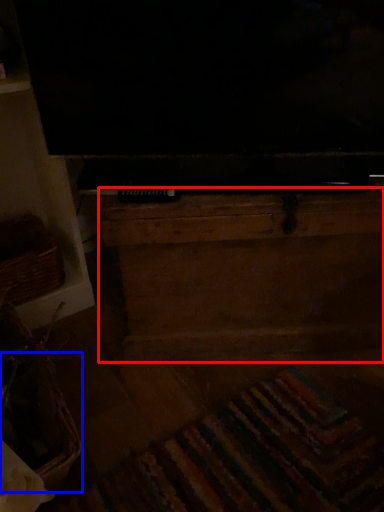
Question: Which point is closer to the camera, dresser (highlighted by a red box) or basket (highlighted by a blue box)?

Choices:
 (A) dresser
 (B) basket

Answer: (B)